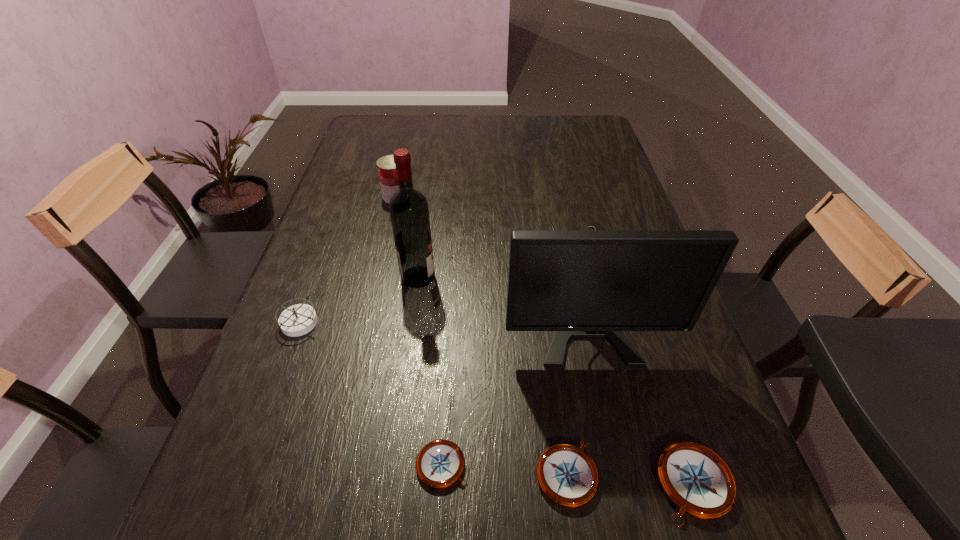
At what (x,y) coordinates should I click in order to perform the action: click on the shortest compass. Please return your answer as a coordinate pair (x, y). The image size is (960, 540). Looking at the image, I should click on (440, 463).

Where is `the shortest object`? the shortest object is located at coordinates point(440,463).

The width and height of the screenshot is (960, 540). I want to click on the second compass from right to left, so click(x=567, y=475).

At what (x,y) coordinates should I click in order to perform the action: click on the third tallest compass. Please return your answer as a coordinate pair (x, y). This screenshot has width=960, height=540. Looking at the image, I should click on (567, 475).

Find the location of `the third shortest compass`. the third shortest compass is located at coordinates (697, 480).

Find the location of `the rightmost compass`. the rightmost compass is located at coordinates (697, 480).

Identify the location of computer monitor. The width and height of the screenshot is (960, 540). (579, 283).

Image resolution: width=960 pixels, height=540 pixels. Identify the location of alcohol. (409, 212).

Identify the location of the fifth shortest object. This screenshot has width=960, height=540. (386, 167).

Identify the location of the second object from left to right. This screenshot has height=540, width=960. (386, 167).